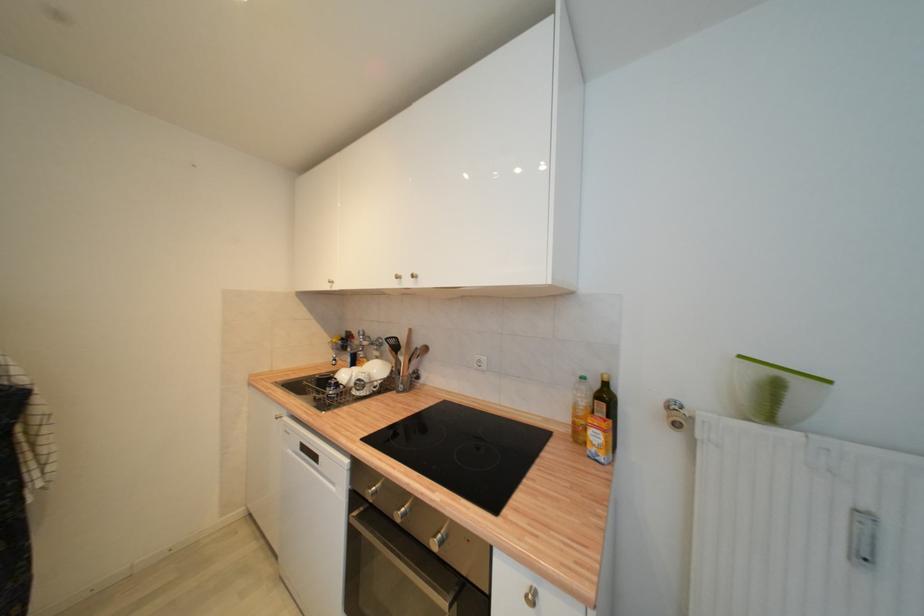
Which object does [606,405] point to?

It corresponds to the dark oil bottle in the image.